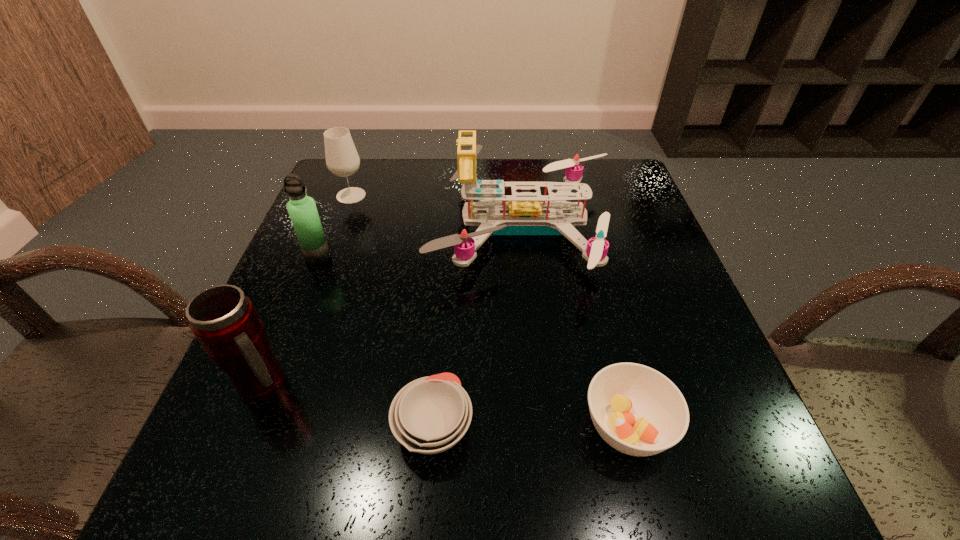
Locate an element on the screen. unoccupied area between the drone and the nearer thermos bottle is located at coordinates (394, 306).

The width and height of the screenshot is (960, 540). I want to click on vacant space that is in between the nearer thermos bottle and the glass, so click(x=307, y=290).

The height and width of the screenshot is (540, 960). In order to click on free point between the shortest object and the glass in this screenshot , I will do `click(393, 311)`.

Locate an element on the screen. empty location between the drone and the left soup bowl is located at coordinates (478, 328).

What are the coordinates of `vacant point located between the left soup bowl and the drone` in the screenshot? It's located at (478, 328).

Find the location of `free space between the drone and the glass`. free space between the drone and the glass is located at coordinates (437, 212).

Locate an element on the screen. The height and width of the screenshot is (540, 960). vacant area that lies between the glass and the nearer thermos bottle is located at coordinates (307, 290).

Identify the location of free spot between the farther thermos bottle and the drone. The height and width of the screenshot is (540, 960). (420, 242).

This screenshot has width=960, height=540. Identify the location of object identified as the third closest to the farther thermos bottle. (225, 321).

What are the coordinates of `object that is the closest to the drone` in the screenshot? It's located at click(342, 159).